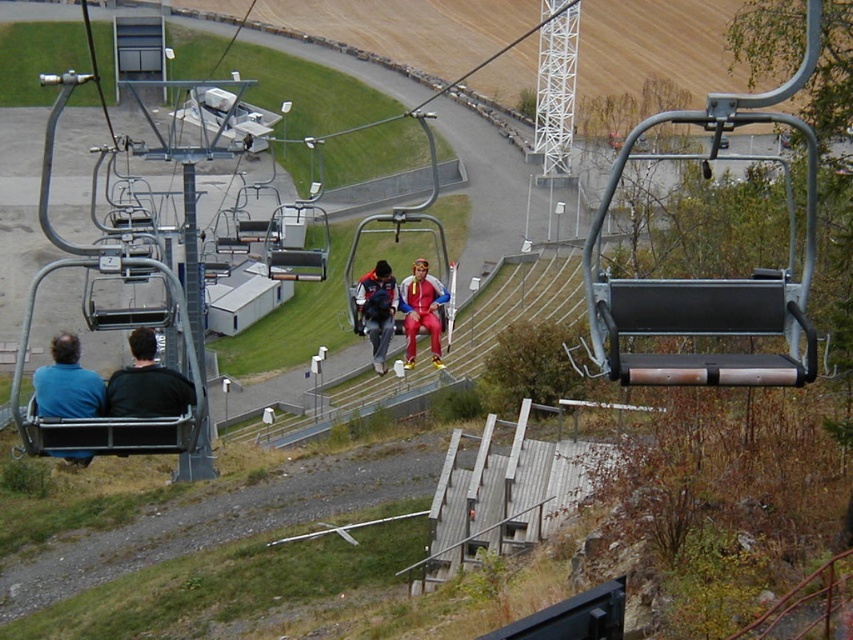
Looking at this image, is matte black seats at lower left wider than dark gray fabric jacket at left?

Indeed, matte black seats at lower left has a greater width compared to dark gray fabric jacket at left.

Which is below, matte black seats at lower left or dark gray fabric jacket at left?

Positioned lower is matte black seats at lower left.

The image size is (853, 640). In order to click on matte black seats at lower left in this screenshot , I will do `click(148, 384)`.

Where is `matte black seats at lower left`? The height and width of the screenshot is (640, 853). matte black seats at lower left is located at coordinates (148, 384).

Where is `blue fabric jacket at left`? blue fabric jacket at left is located at coordinates click(67, 384).

Image resolution: width=853 pixels, height=640 pixels. Find the location of `blue fabric jacket at left`. blue fabric jacket at left is located at coordinates (67, 384).

Is dark gray fabric jacket at left smaller than matte gray backpack at center?

Yes, dark gray fabric jacket at left is smaller than matte gray backpack at center.

Does dark gray fabric jacket at left lie behind matte gray backpack at center?

No, dark gray fabric jacket at left is in front of matte gray backpack at center.

At what (x,y) coordinates should I click in order to perform the action: click on dark gray fabric jacket at left. Please return your answer as a coordinate pair (x, y). Image resolution: width=853 pixels, height=640 pixels. Looking at the image, I should click on (146, 384).